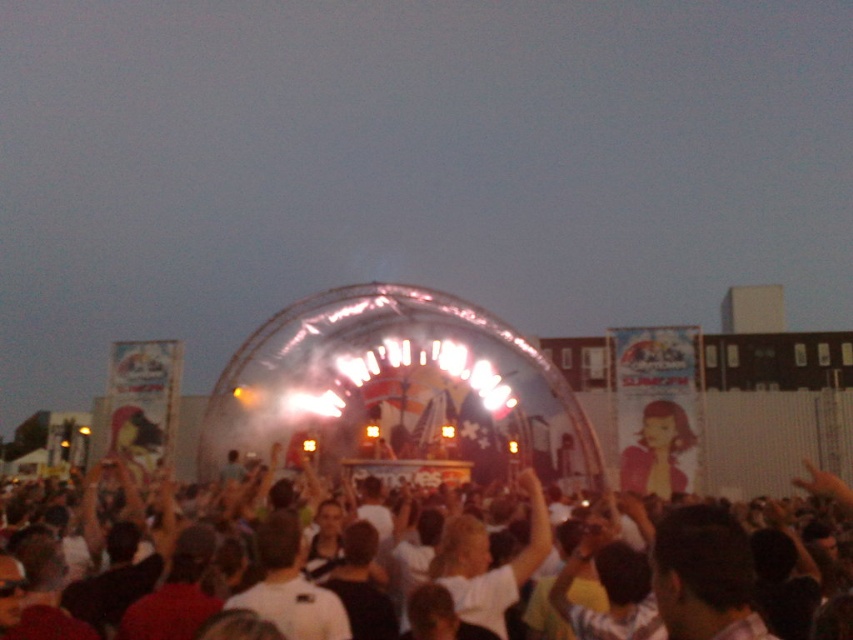
You are standing at the concert venue and want to know how far the point at coordinates point (288, 602) is from your current position. Can you determine the distance?

The point (288, 602) is 93.38 meters away from your current position.

You are standing at the point marked by the coordinates point (198, 588). Looking around, you see the white cotton crowd at center. What is the nearest object to you?

The nearest object to you is the white cotton crowd at center, as you are standing at the point that marks its location.

You are a photographer at the concert and want to capture a photo of the matte pink shirt at center without the white cotton crowd at center blocking it. Is this possible based on their positions?

The white cotton crowd at center is closer to the viewer than the matte pink shirt at center, so the crowd would block the view of the matte pink shirt at center. It is not possible to capture the matte pink shirt at center without the crowd blocking it.